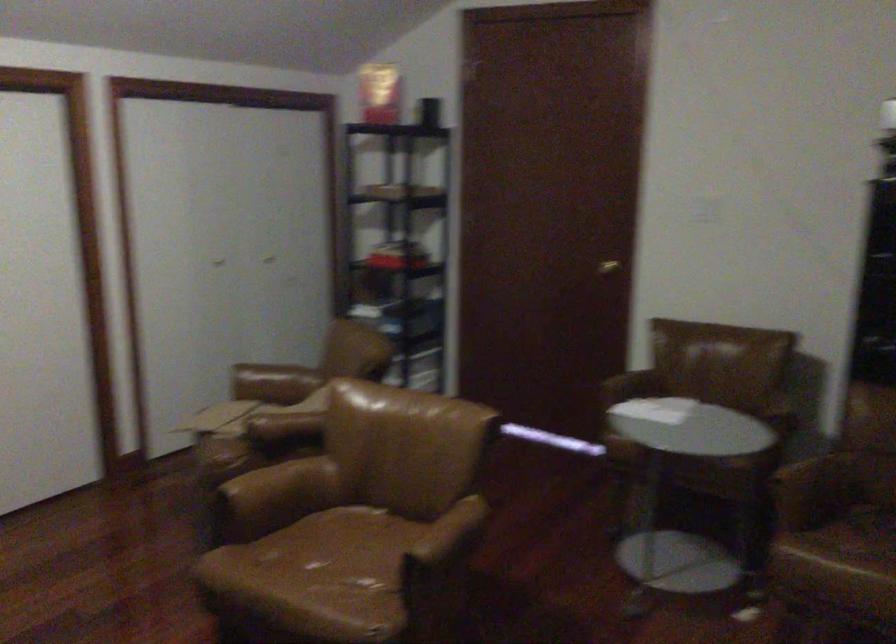
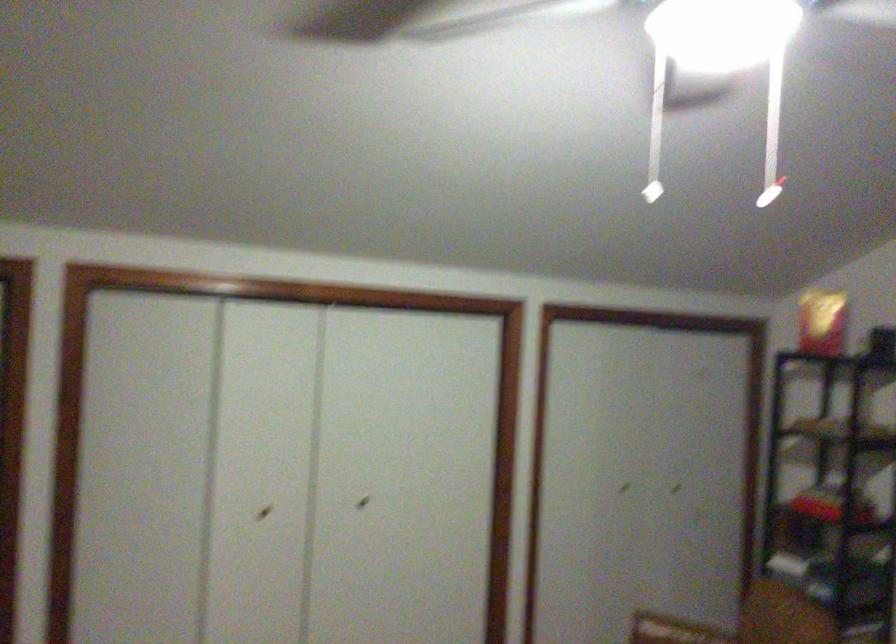
The point at (228, 249) is marked in the first image. Where is the corresponding point in the second image?

(623, 488)